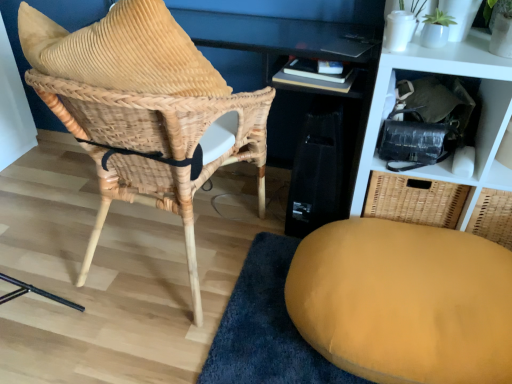
Question: Based on their sizes in the image, would you say woven rattan chair at left is bigger or smaller than velvet yellow ottoman at lower right?

Choices:
 (A) small
 (B) big

Answer: (B)

Question: From a real-world perspective, is woven rattan chair at left physically located above or below velvet yellow ottoman at lower right?

Choices:
 (A) above
 (B) below

Answer: (A)

Question: Considering the real-world distances, which object is farthest from the woven rattan chair at left?

Choices:
 (A) velvet yellow ottoman at lower right
 (B) woven wicker basket at upper right

Answer: (B)

Question: Estimate the real-world distances between objects in this image. Which object is closer to the woven wicker basket at upper right?

Choices:
 (A) velvet yellow ottoman at lower right
 (B) woven rattan chair at left

Answer: (A)